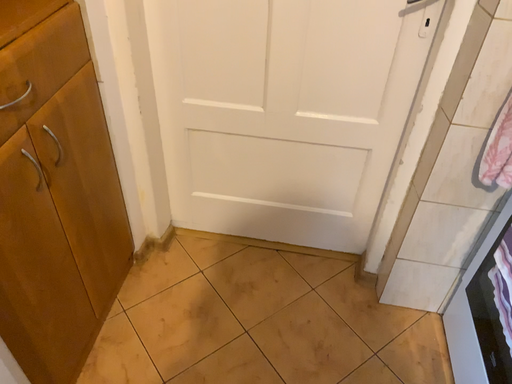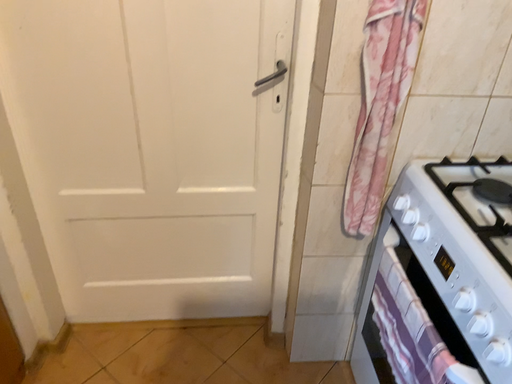
Question: How did the camera likely rotate when shooting the video?

Choices:
 (A) rotated upward
 (B) rotated downward

Answer: (A)